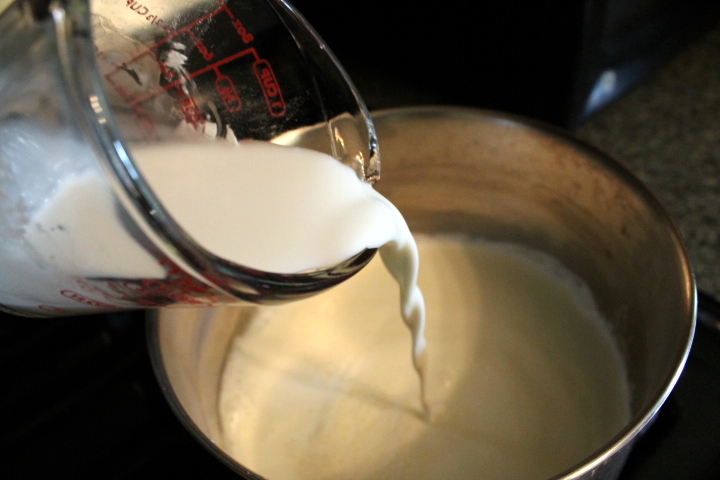
This screenshot has width=720, height=480. In order to click on measuring cup in this screenshot , I will do `click(246, 100)`.